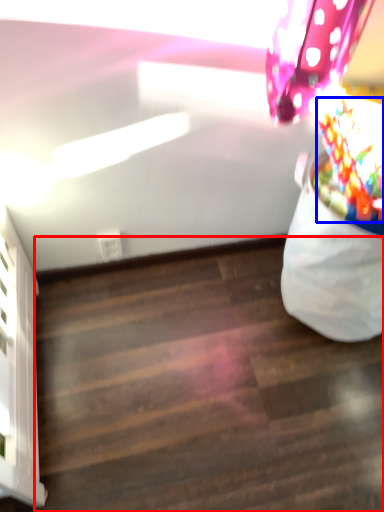
Question: Which object appears farthest to the camera in this image, stairwell (highlighted by a red box) or flower (highlighted by a blue box)?

Choices:
 (A) stairwell
 (B) flower

Answer: (A)